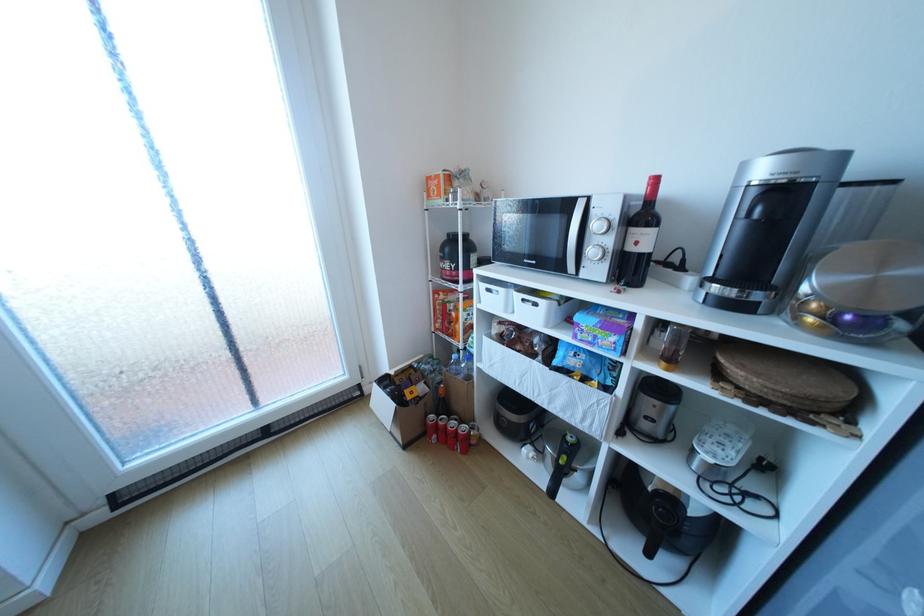
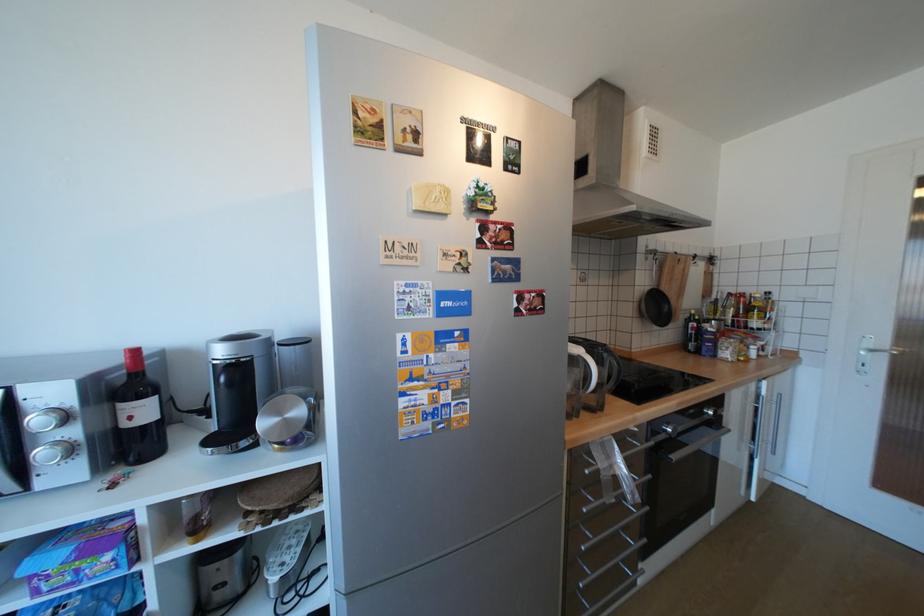
Where in the second image is the point corresponding to (600,251) from the first image?

(52, 453)